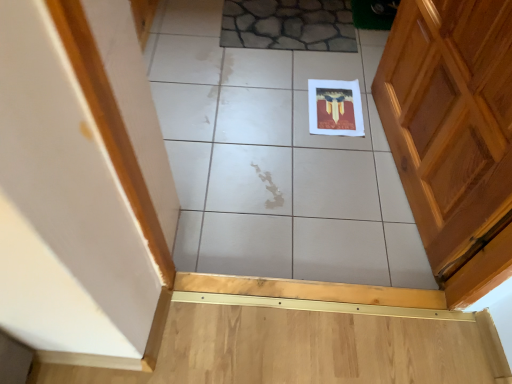
Question: In which direction should I rotate to look at white glossy tile at center, which is counted as the 2th ceramic tile, starting from the top?

Choices:
 (A) left
 (B) right

Answer: (B)

Question: Is white glossy tile at center, which is counted as the 2th ceramic tile, starting from the top, bigger than stone-like ceramic tile at upper center, the 1th ceramic tile from the top?

Choices:
 (A) no
 (B) yes

Answer: (B)

Question: Does white glossy tile at center, placed as the 1th ceramic tile when sorted from bottom to top, have a lesser width compared to stone-like ceramic tile at upper center, the 1th ceramic tile from the top?

Choices:
 (A) no
 (B) yes

Answer: (A)

Question: Does white glossy tile at center, placed as the 1th ceramic tile when sorted from bottom to top, have a lesser height compared to stone-like ceramic tile at upper center, the 1th ceramic tile from the top?

Choices:
 (A) no
 (B) yes

Answer: (A)

Question: Is white glossy tile at center, placed as the 1th ceramic tile when sorted from bottom to top, oriented away from stone-like ceramic tile at upper center, positioned as the 2th ceramic tile in bottom-to-top order?

Choices:
 (A) yes
 (B) no

Answer: (A)

Question: Is stone-like ceramic tile at upper center, positioned as the 2th ceramic tile in bottom-to-top order, inside white glossy tile at center, which is counted as the 2th ceramic tile, starting from the top?

Choices:
 (A) no
 (B) yes

Answer: (B)

Question: Does white glossy tile at center, placed as the 1th ceramic tile when sorted from bottom to top, have a greater width compared to stone-like ceramic tile at upper center, the 1th ceramic tile from the top?

Choices:
 (A) yes
 (B) no

Answer: (A)

Question: Is stone-like ceramic tile at upper center, positioned as the 2th ceramic tile in bottom-to-top order, outside white glossy tile at center, which is counted as the 2th ceramic tile, starting from the top?

Choices:
 (A) no
 (B) yes

Answer: (A)

Question: Does stone-like ceramic tile at upper center, the 1th ceramic tile from the top, come behind white glossy tile at center, placed as the 1th ceramic tile when sorted from bottom to top?

Choices:
 (A) yes
 (B) no

Answer: (A)

Question: From the image's perspective, is stone-like ceramic tile at upper center, the 1th ceramic tile from the top, located beneath white glossy tile at center, placed as the 1th ceramic tile when sorted from bottom to top?

Choices:
 (A) yes
 (B) no

Answer: (B)

Question: Can you confirm if stone-like ceramic tile at upper center, the 1th ceramic tile from the top, is bigger than white glossy tile at center, which is counted as the 2th ceramic tile, starting from the top?

Choices:
 (A) no
 (B) yes

Answer: (A)

Question: Is stone-like ceramic tile at upper center, the 1th ceramic tile from the top, far away from white glossy tile at center, which is counted as the 2th ceramic tile, starting from the top?

Choices:
 (A) no
 (B) yes

Answer: (A)

Question: Is stone-like ceramic tile at upper center, the 1th ceramic tile from the top, taller than white glossy tile at center, which is counted as the 2th ceramic tile, starting from the top?

Choices:
 (A) no
 (B) yes

Answer: (A)

Question: Is point (283, 102) positioned closer to the camera than point (259, 8)?

Choices:
 (A) closer
 (B) farther

Answer: (A)